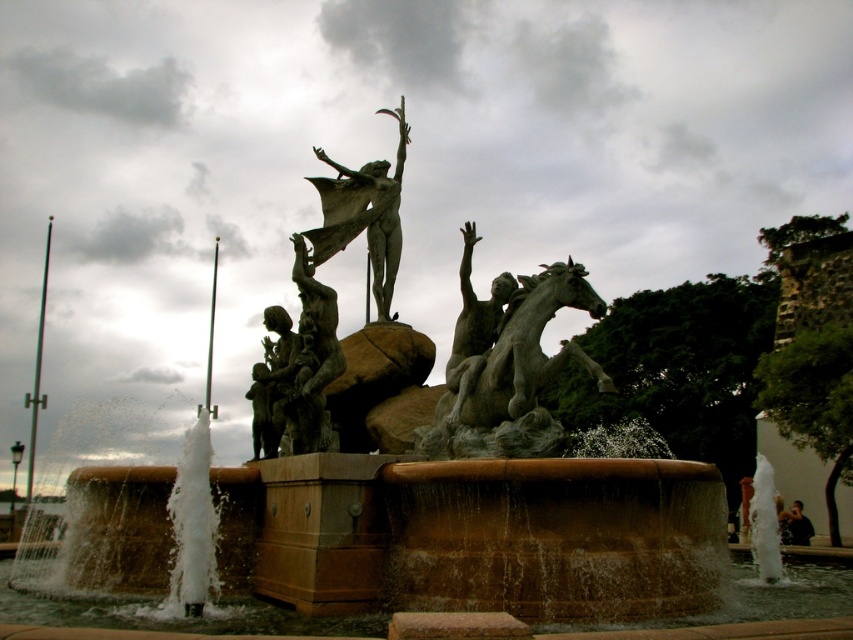
Question: Is bronze statue group at center above polished bronze statue at center?

Choices:
 (A) no
 (B) yes

Answer: (A)

Question: Which object is the farthest from the polished bronze statue at center?

Choices:
 (A) bronze statue of man at center
 (B) bronze statue group at center
 (C) bronze statue at center

Answer: (C)

Question: Where is bronze statue at center located in relation to bronze statue of man at center in the image?

Choices:
 (A) right
 (B) left

Answer: (A)

Question: Can you confirm if bronze statue at center is positioned to the right of polished bronze statue at center?

Choices:
 (A) yes
 (B) no

Answer: (A)

Question: Which point is closer to the camera taking this photo?

Choices:
 (A) (373, 189)
 (B) (525, 336)
 (C) (479, 348)

Answer: (B)

Question: Which object appears closest to the camera in this image?

Choices:
 (A) bronze statue of man at center
 (B) black fabric person at lower right
 (C) bronze statue group at center

Answer: (A)